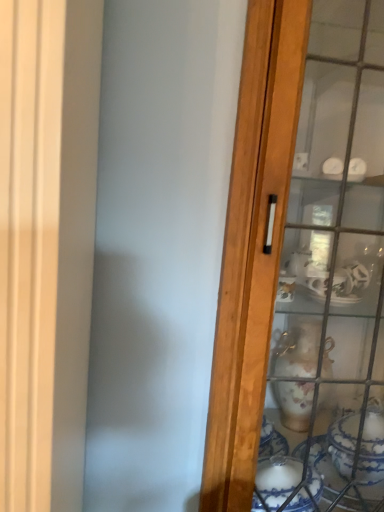
Locate an element on the screen. This screenshot has height=512, width=384. wooden door at right is located at coordinates (303, 255).

Describe the element at coordinates (303, 255) in the screenshot. This screenshot has height=512, width=384. I see `wooden door at right` at that location.

This screenshot has height=512, width=384. In order to click on wooden door at right in this screenshot , I will do `click(303, 255)`.